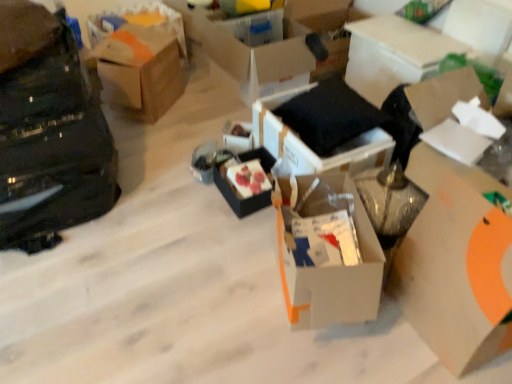
Find the location of a particular element. The width and height of the screenshot is (512, 384). vacant space situated above black matte box at center, acting as the second box starting from the left (from a real-world perspective) is located at coordinates (252, 170).